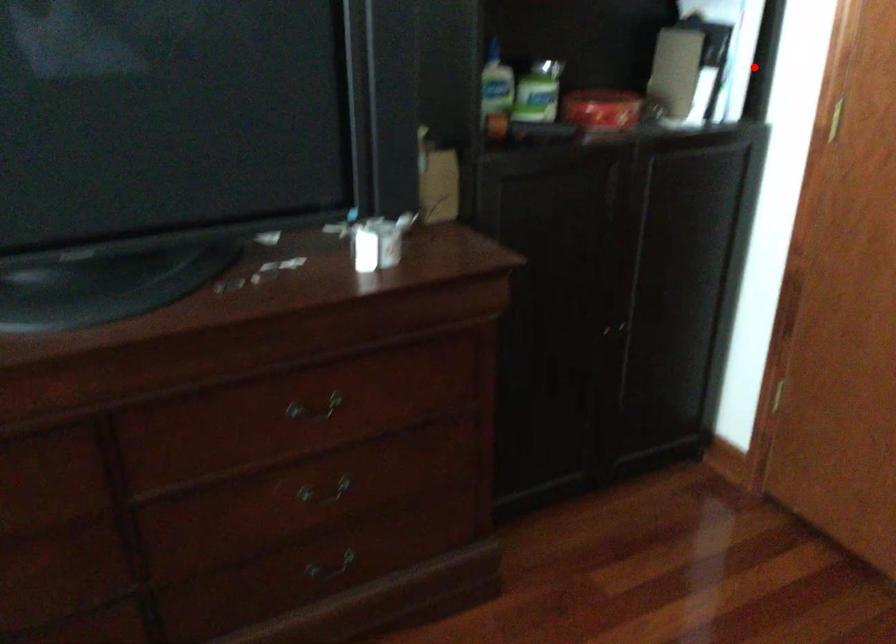
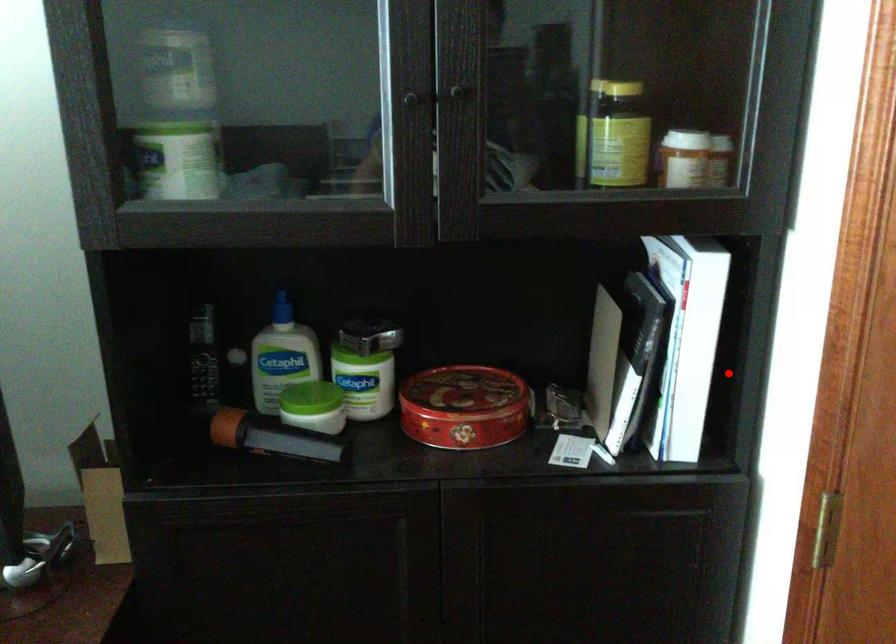
I am providing you with two images of the same scene from different viewpoints. A red point is marked on the first image and another point is marked on the second image. Is the marked point in image1 the same physical position as the marked point in image2?

Yes